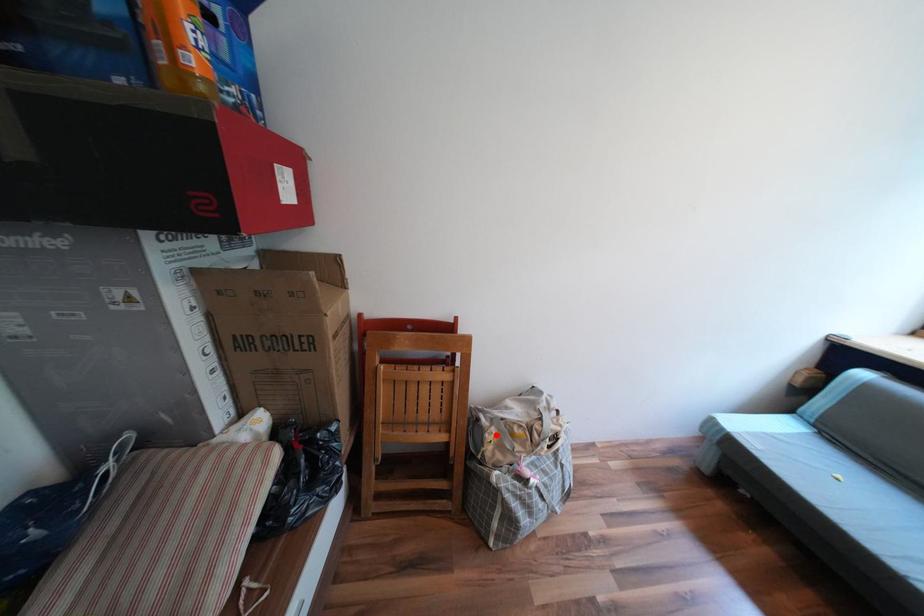
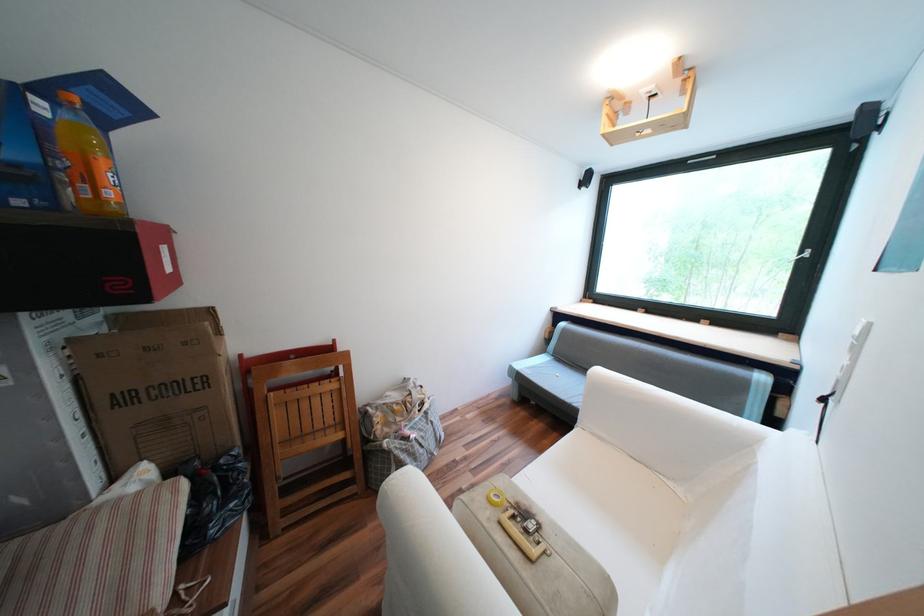
Where in the second image is the point corresponding to the highlighted location from the first image?

(383, 419)